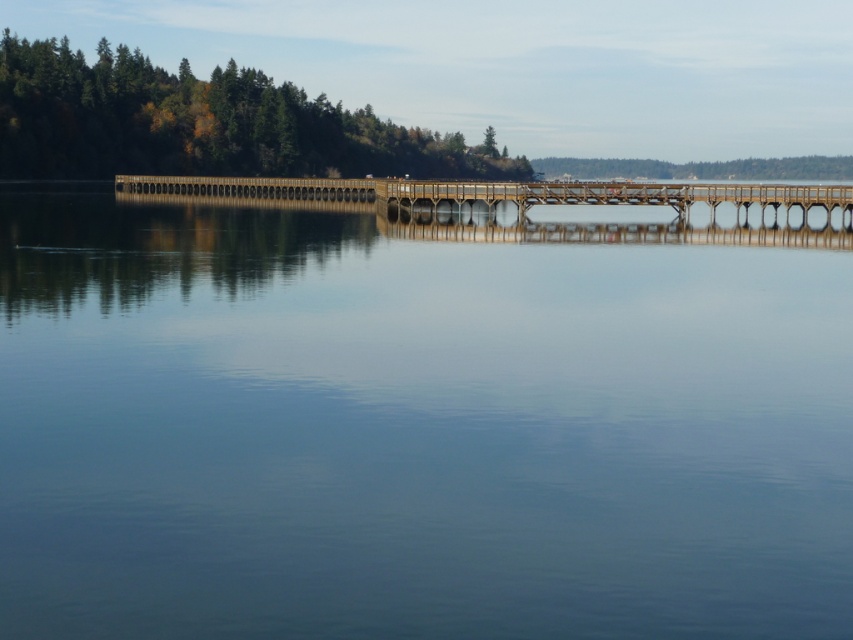
You are standing on the wooden pier and looking at the point marked as point (415,426). What do you see at that location?

You see transparent glass water at center at point (415,426).

You are an artist planning to paint the landscape scene. You want to emphasize the green matte trees at upper left and the brown wooden bridge at center. Which object should you paint larger to maintain the scene proportions?

The green matte trees at upper left should be painted larger than the brown wooden bridge at center because they are described as having a larger size compared to the bridge.

You are standing at the edge of the wooden pier and want to reach a specific point marked as point (360, 563). The pier is 30 feet long. Can you walk the entire length of the pier to reach that point?

The distance between you and point (360, 563) is 32.55 feet, which is longer than the pier length of 30 feet. Therefore, you cannot walk the entire length of the pier to reach that point.